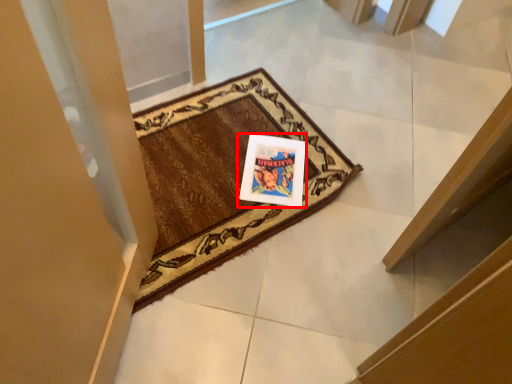
Question: From the image's perspective, where is picture frame (annotated by the red box) located relative to mat?

Choices:
 (A) below
 (B) above

Answer: (A)